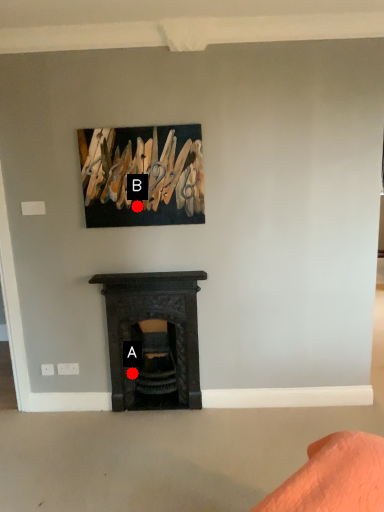
Question: Two points are circled on the image, labeled by A and B beside each circle. Which point is closer to the camera?

Choices:
 (A) A is closer
 (B) B is closer

Answer: (B)